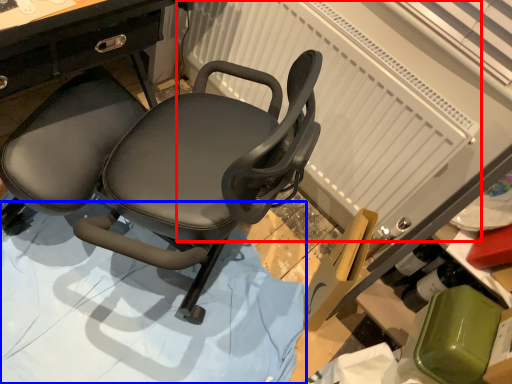
Question: Which object is further to the camera taking this photo, radiator (highlighted by a red box) or surface (highlighted by a blue box)?

Choices:
 (A) radiator
 (B) surface

Answer: (A)